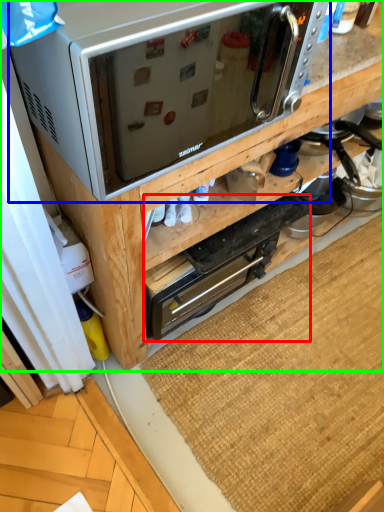
Question: Which object is positioned closest to appliance (highlighted by a red box)? Select from microwave oven (highlighted by a blue box) and cabinetry (highlighted by a green box).

Choices:
 (A) microwave oven
 (B) cabinetry

Answer: (B)